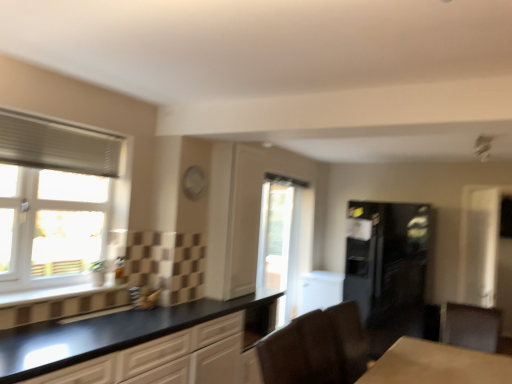
Identify the location of free spot above white pleated blind at upper left (from a real-world perspective). This screenshot has height=384, width=512. (65, 125).